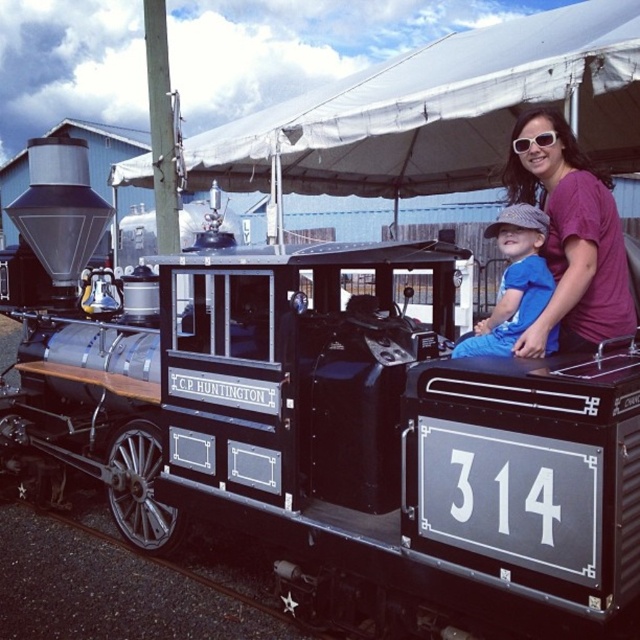
Between purple cotton shirt at upper right and blue cotton shirt at center, which one has more height?

With more height is purple cotton shirt at upper right.

Is purple cotton shirt at upper right below blue cotton shirt at center?

No.

Locate an element on the screen. purple cotton shirt at upper right is located at coordinates (572, 241).

Where is `purple cotton shirt at upper right`? The width and height of the screenshot is (640, 640). purple cotton shirt at upper right is located at coordinates (572, 241).

Does white fabric canopy at upper center have a larger size compared to blue cotton shirt at center?

Yes.

Is point (212, 157) positioned after point (500, 314)?

Yes, point (212, 157) is farther from viewer.

The height and width of the screenshot is (640, 640). Identify the location of white fabric canopy at upper center. (442, 109).

Who is taller, white fabric canopy at upper center or purple cotton shirt at upper right?

Standing taller between the two is white fabric canopy at upper center.

This screenshot has height=640, width=640. Find the location of `white fabric canopy at upper center`. white fabric canopy at upper center is located at coordinates (442, 109).